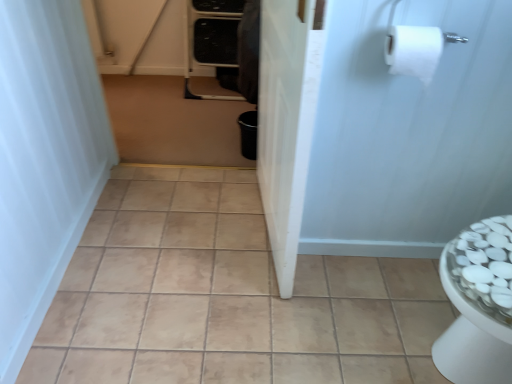
In order to click on vacant point above beige ceramic tile at center (from a real-world perspective) in this screenshot , I will do `click(236, 256)`.